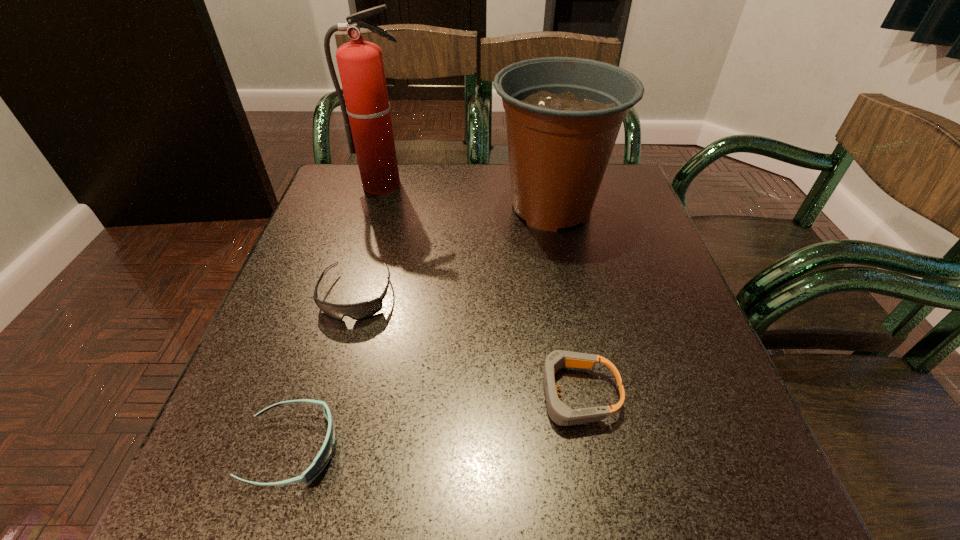
The height and width of the screenshot is (540, 960). Find the location of `fire extinguisher located in the far edge section of the desktop`. fire extinguisher located in the far edge section of the desktop is located at coordinates (367, 119).

Where is `flowerpot present at the far edge`? The width and height of the screenshot is (960, 540). flowerpot present at the far edge is located at coordinates coord(563,114).

This screenshot has width=960, height=540. In order to click on object that is at the near edge in this screenshot , I will do `click(321, 460)`.

I want to click on fire extinguisher that is at the left edge, so click(x=367, y=119).

In order to click on object located in the right edge section of the desktop in this screenshot , I will do `click(563, 114)`.

The height and width of the screenshot is (540, 960). I want to click on object that is at the far left corner, so click(367, 119).

Identify the location of object that is at the near left corner. The width and height of the screenshot is (960, 540). (321, 460).

This screenshot has height=540, width=960. I want to click on object present at the far right corner, so click(x=563, y=114).

Where is `vacant space at the far edge`? The height and width of the screenshot is (540, 960). vacant space at the far edge is located at coordinates (424, 167).

You are a GUI agent. You are given a task and a screenshot of the screen. Output one action in this format:
    pyautogui.click(x=<x>, y=<y>)
    Task: Click on the vacant space at the near edge
    Image resolution: width=960 pixels, height=540 pixels.
    Given the screenshot: What is the action you would take?
    pyautogui.click(x=430, y=483)